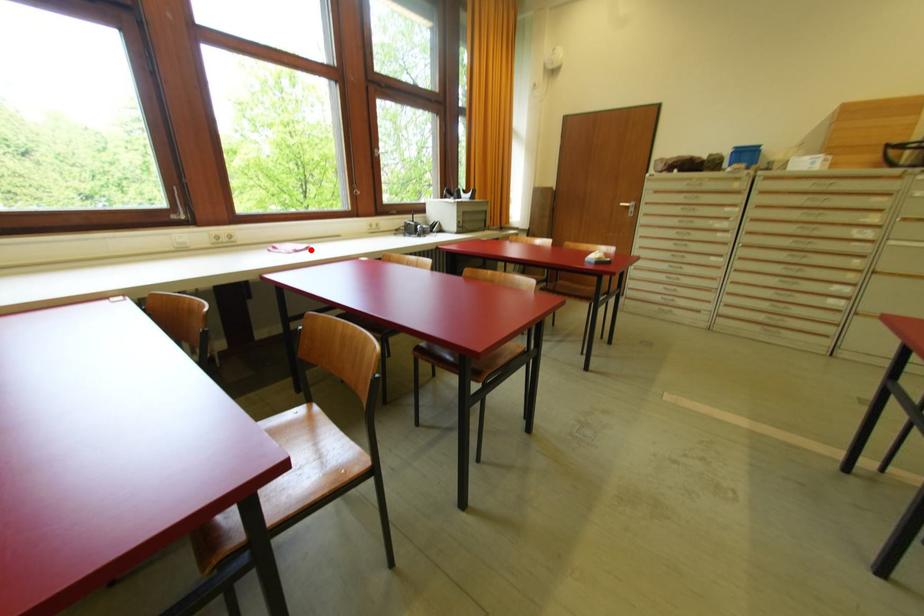
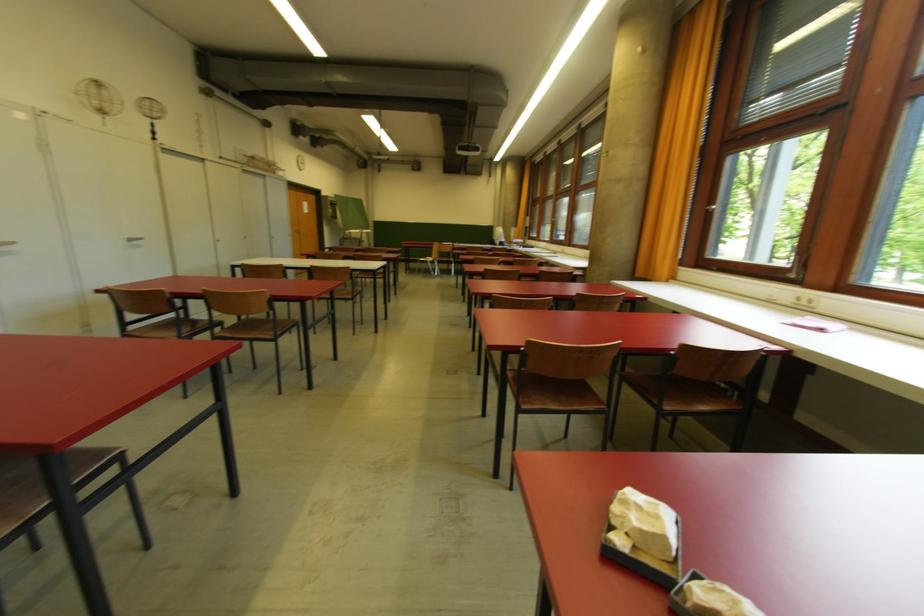
Locate, in the second image, the point that corresponds to the highlighted location in the first image.

(823, 331)